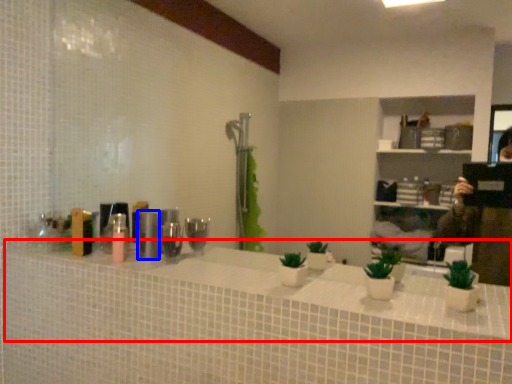
Question: Which object appears farthest to the camera in this image, counter top (highlighted by a red box) or toiletry (highlighted by a blue box)?

Choices:
 (A) counter top
 (B) toiletry

Answer: (B)